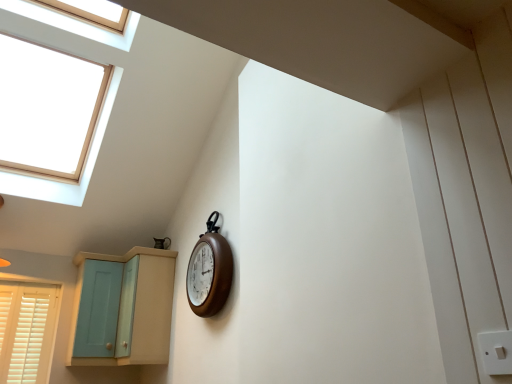
Question: Is light blue wood cabinet at lower left a part of white plastic switch at lower right?

Choices:
 (A) no
 (B) yes

Answer: (A)

Question: Could you tell me if white plastic switch at lower right is facing light blue wood cabinet at lower left?

Choices:
 (A) yes
 (B) no

Answer: (B)

Question: Are white plastic switch at lower right and light blue wood cabinet at lower left making contact?

Choices:
 (A) yes
 (B) no

Answer: (B)

Question: Does white plastic switch at lower right have a lesser width compared to light blue wood cabinet at lower left?

Choices:
 (A) no
 (B) yes

Answer: (B)

Question: From a real-world perspective, does white plastic switch at lower right sit lower than light blue wood cabinet at lower left?

Choices:
 (A) no
 (B) yes

Answer: (B)

Question: Is wooden clock at center taller or shorter than white plastic switch at lower right?

Choices:
 (A) tall
 (B) short

Answer: (A)

Question: Does point (193, 251) appear closer or farther from the camera than point (499, 354)?

Choices:
 (A) farther
 (B) closer

Answer: (A)

Question: Do you think wooden clock at center is within white plastic switch at lower right, or outside of it?

Choices:
 (A) inside
 (B) outside

Answer: (B)

Question: Considering the positions of wooden clock at center and white plastic switch at lower right in the image, is wooden clock at center wider or thinner than white plastic switch at lower right?

Choices:
 (A) thin
 (B) wide

Answer: (B)

Question: Is wooden clock at center wider or thinner than light teal wood cabinet at lower left?

Choices:
 (A) thin
 (B) wide

Answer: (A)

Question: From the image's perspective, relative to light teal wood cabinet at lower left, is wooden clock at center above or below?

Choices:
 (A) above
 (B) below

Answer: (A)

Question: Does point (215, 286) appear closer or farther from the camera than point (147, 268)?

Choices:
 (A) closer
 (B) farther

Answer: (A)

Question: Considering the relative positions of wooden clock at center and light teal wood cabinet at lower left in the image provided, is wooden clock at center to the left or to the right of light teal wood cabinet at lower left?

Choices:
 (A) right
 (B) left

Answer: (A)

Question: Is light teal wood cabinet at lower left bigger or smaller than wooden clock at center?

Choices:
 (A) big
 (B) small

Answer: (A)

Question: Looking at their shapes, would you say light teal wood cabinet at lower left is wider or thinner than wooden clock at center?

Choices:
 (A) wide
 (B) thin

Answer: (A)